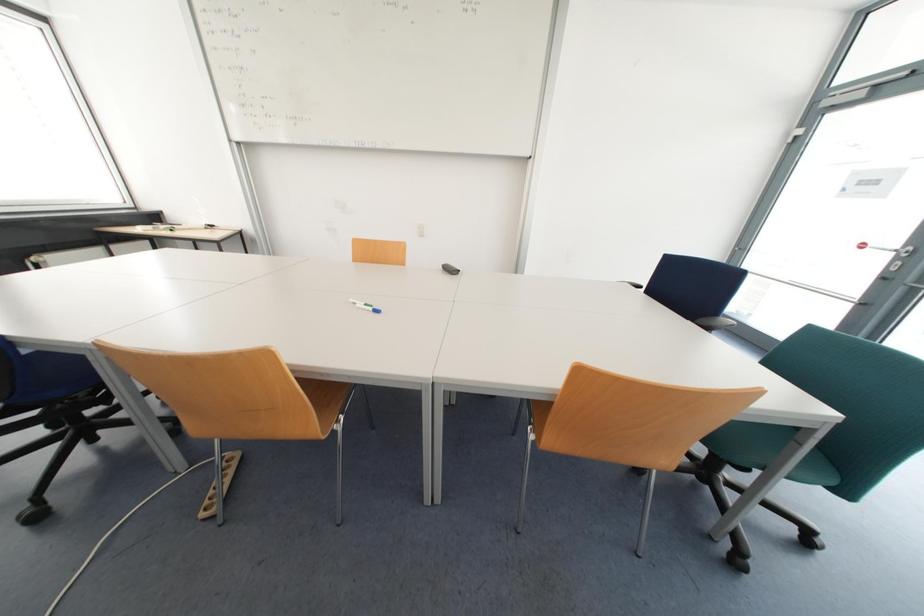
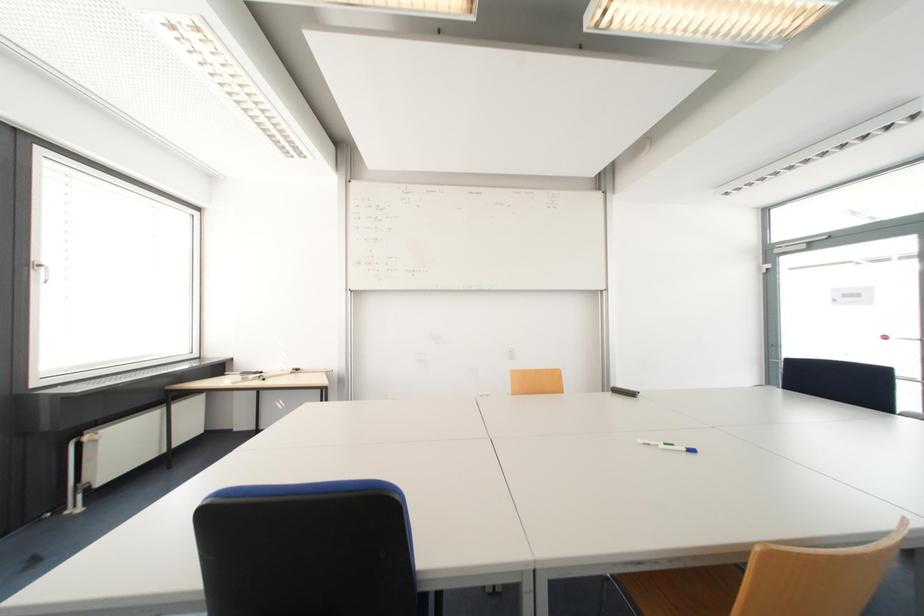
Question: What movement of the cameraman would produce the second image?

Choices:
 (A) Left
 (B) Right
 (C) Forward
 (D) Backward

Answer: (A)